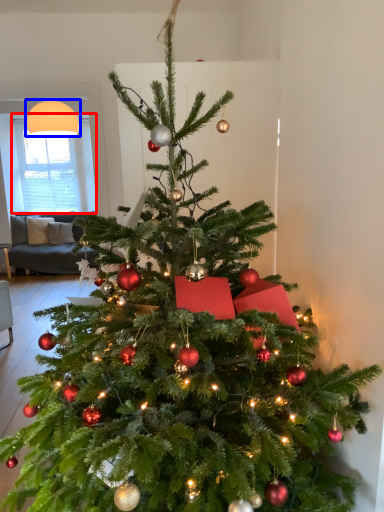
Question: Which object appears closest to the camera in this image, window screen (highlighted by a red box) or lamp (highlighted by a blue box)?

Choices:
 (A) window screen
 (B) lamp

Answer: (B)